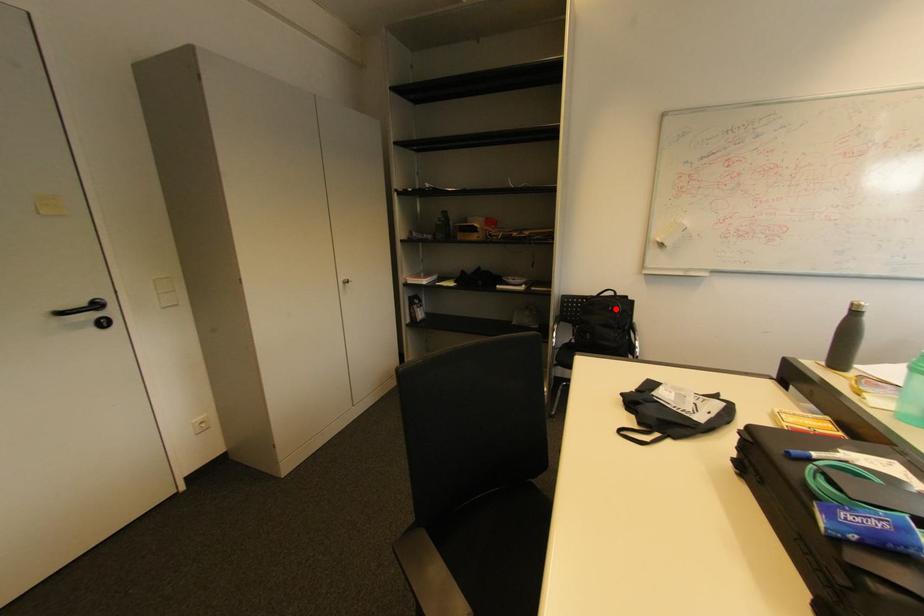
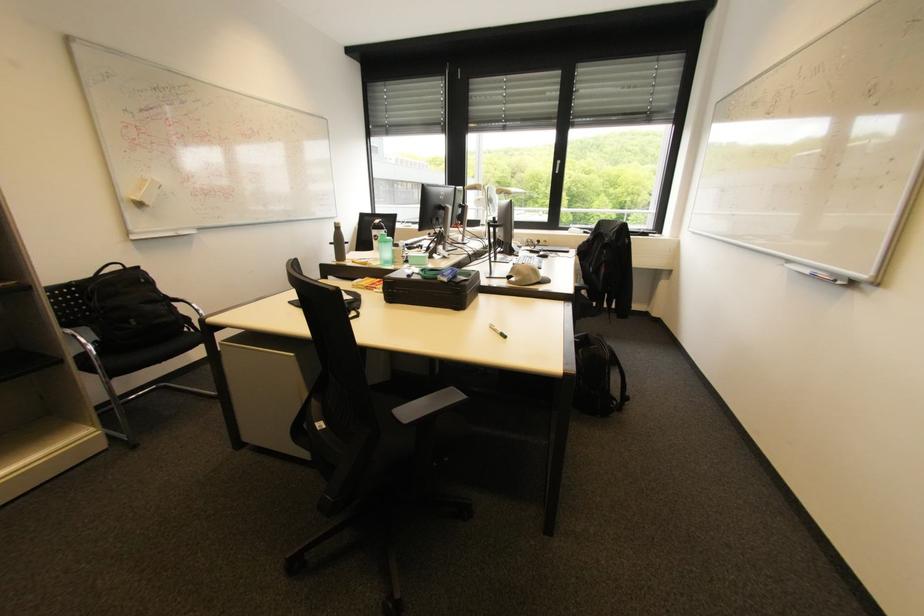
Where in the second image is the point corresponding to the highlighted location from the first image?

(148, 281)